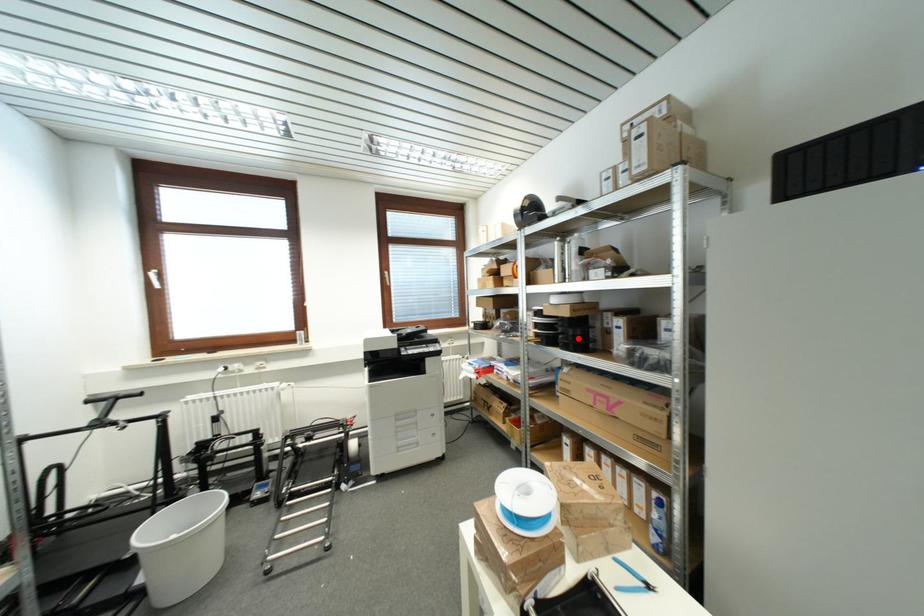
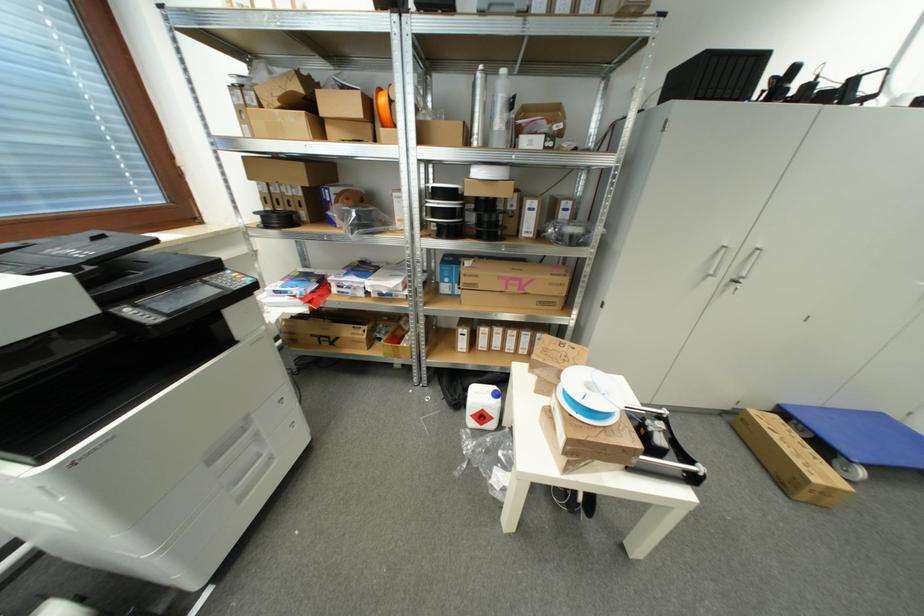
The point at the highlighted location is marked in the first image. Where is the corresponding point in the second image?

(493, 225)